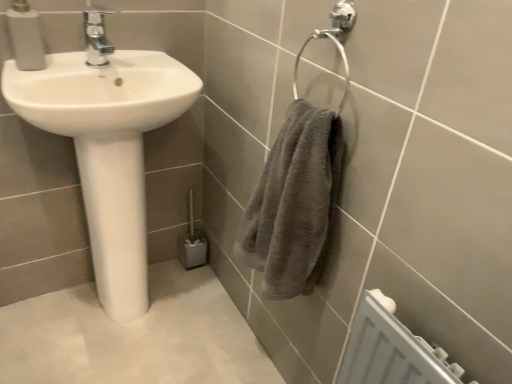
Measure the distance between point (106,45) and camera.

A distance of 1.08 meters exists between point (106,45) and camera.

Describe the element at coordinates (96, 36) in the screenshot. This screenshot has width=512, height=384. I see `chrome metallic faucet at upper center` at that location.

The width and height of the screenshot is (512, 384). What do you see at coordinates (106, 149) in the screenshot? I see `white glossy sink at left` at bounding box center [106, 149].

At what (x,y) coordinates should I click in order to perform the action: click on gray fluffy towel at right. Please return your answer as a coordinate pair (x, y). Looking at the image, I should click on (294, 203).

From the picture: Is white glossy sink at left taller than matte white soap dispenser at upper left?

Yes.

Is white glossy sink at left not close to matte white soap dispenser at upper left?

That's not correct — white glossy sink at left is a little close to matte white soap dispenser at upper left.

Which object is closer to the camera taking this photo, white glossy sink at left or matte white soap dispenser at upper left?

white glossy sink at left is more forward.

How many degrees apart are the facing directions of white glossy sink at left and matte white soap dispenser at upper left?

The angle between the facing direction of white glossy sink at left and the facing direction of matte white soap dispenser at upper left is 0.000233 degrees.

Is point (94, 52) behind point (279, 276)?

Yes, it is behind point (279, 276).

Is chrome metallic faucet at upper center not near gray fluffy towel at right?

chrome metallic faucet at upper center is near gray fluffy towel at right, not far away.

Looking at this image, from the image's perspective, which object appears higher, chrome metallic faucet at upper center or gray fluffy towel at right?

chrome metallic faucet at upper center.

In terms of height, does chrome metallic faucet at upper center look taller or shorter compared to gray fluffy towel at right?

Considering their sizes, chrome metallic faucet at upper center has less height than gray fluffy towel at right.

Can you confirm if gray fluffy towel at right is positioned to the left of white glossy sink at left?

Incorrect, gray fluffy towel at right is not on the left side of white glossy sink at left.

Who is more distant, gray fluffy towel at right or white glossy sink at left?

Positioned behind is white glossy sink at left.

Which of these two, gray fluffy towel at right or white glossy sink at left, is thinner?

Thinner between the two is gray fluffy towel at right.

This screenshot has width=512, height=384. Find the location of `sink on the left of gray fluffy towel at right`. sink on the left of gray fluffy towel at right is located at coordinates (106, 149).

Who is shorter, gray fluffy towel at right or matte white soap dispenser at upper left?

matte white soap dispenser at upper left.

Can you confirm if gray fluffy towel at right is thinner than matte white soap dispenser at upper left?

No.

Is point (303, 237) more distant than point (27, 63)?

No, it is not.

Is matte white soap dispenser at upper left a part of gray fluffy towel at right?

No, matte white soap dispenser at upper left is not inside gray fluffy towel at right.

Is point (88, 64) less distant than point (109, 215)?

Yes.

From a real-world perspective, is chrome metallic faucet at upper center under white glossy sink at left?

Incorrect, from a real-world perspective, chrome metallic faucet at upper center is higher than white glossy sink at left.

Is chrome metallic faucet at upper center bigger or smaller than white glossy sink at left?

In the image, chrome metallic faucet at upper center appears to be smaller than white glossy sink at left.

Considering the relative sizes of chrome metallic faucet at upper center and white glossy sink at left in the image provided, is chrome metallic faucet at upper center thinner than white glossy sink at left?

Yes, chrome metallic faucet at upper center is thinner than white glossy sink at left.

Considering the positions of point (118, 288) and point (103, 34), is point (118, 288) closer or farther from the camera than point (103, 34)?

Point (118, 288) is farther from the camera than point (103, 34).

Can you see white glossy sink at left touching chrome metallic faucet at upper center?

No, white glossy sink at left is not with chrome metallic faucet at upper center.

The height and width of the screenshot is (384, 512). Identify the location of tap above the white glossy sink at left (from the image's perspective). (96, 36).

In the scene shown: From the image's perspective, who appears lower, white glossy sink at left or chrome metallic faucet at upper center?

white glossy sink at left appears lower in the image.

Is point (104, 14) closer to camera compared to point (27, 37)?

No, it is not.

Is matte white soap dispenser at upper left at the back of chrome metallic faucet at upper center?

That's not correct — chrome metallic faucet at upper center is not looking away from matte white soap dispenser at upper left.

In the scene shown: Is there a large distance between chrome metallic faucet at upper center and matte white soap dispenser at upper left?

They are positioned close to each other.

What's the angular difference between chrome metallic faucet at upper center and matte white soap dispenser at upper left's facing directions?

They differ by 0.000722 degrees in their facing directions.

This screenshot has height=384, width=512. I want to click on sink below the matte white soap dispenser at upper left (from a real-world perspective), so click(x=106, y=149).

Image resolution: width=512 pixels, height=384 pixels. I want to click on tap above the gray fluffy towel at right (from the image's perspective), so click(96, 36).

Looking at the image, which one is located closer to matte white soap dispenser at upper left, white glossy sink at left or gray fluffy towel at right?

The object closer to matte white soap dispenser at upper left is white glossy sink at left.

Estimate the real-world distances between objects in this image. Which object is closer to white glossy sink at left, matte white soap dispenser at upper left or chrome metallic faucet at upper center?

The object closer to white glossy sink at left is chrome metallic faucet at upper center.

Based on their spatial positions, is matte white soap dispenser at upper left or gray fluffy towel at right closer to white glossy sink at left?

Based on the image, matte white soap dispenser at upper left appears to be nearer to white glossy sink at left.

When comparing their distances from matte white soap dispenser at upper left, does chrome metallic faucet at upper center or white glossy sink at left seem further?

Based on the image, white glossy sink at left appears to be further to matte white soap dispenser at upper left.

When comparing their distances from white glossy sink at left, does chrome metallic faucet at upper center or gray fluffy towel at right seem closer?

chrome metallic faucet at upper center is positioned closer to the anchor white glossy sink at left.

Based on their spatial positions, is matte white soap dispenser at upper left or gray fluffy towel at right closer to chrome metallic faucet at upper center?

Based on the image, matte white soap dispenser at upper left appears to be nearer to chrome metallic faucet at upper center.

Considering their positions, is chrome metallic faucet at upper center positioned further to white glossy sink at left than matte white soap dispenser at upper left?

The object further to white glossy sink at left is matte white soap dispenser at upper left.

When comparing their distances from matte white soap dispenser at upper left, does chrome metallic faucet at upper center or gray fluffy towel at right seem closer?

Based on the image, chrome metallic faucet at upper center appears to be nearer to matte white soap dispenser at upper left.

This screenshot has width=512, height=384. I want to click on tap situated between white glossy sink at left and gray fluffy towel at right from left to right, so click(x=96, y=36).

Find the location of a particular element. Image resolution: width=512 pixels, height=384 pixels. tap between matte white soap dispenser at upper left and white glossy sink at left from top to bottom is located at coordinates (96, 36).

You are a GUI agent. You are given a task and a screenshot of the screen. Output one action in this format:
    pyautogui.click(x=<x>, y=<y>)
    Task: Click on the sink between matte white soap dispenser at upper left and gray fluffy towel at right in the horizontal direction
    This screenshot has height=384, width=512.
    Given the screenshot: What is the action you would take?
    pyautogui.click(x=106, y=149)

Locate an element on the screen. This screenshot has width=512, height=384. tap between matte white soap dispenser at upper left and gray fluffy towel at right from left to right is located at coordinates (96, 36).